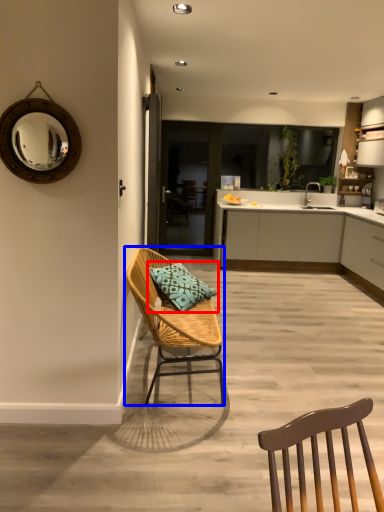
Question: Which object appears closest to the camera in this image, pillow (highlighted by a red box) or chair (highlighted by a blue box)?

Choices:
 (A) pillow
 (B) chair

Answer: (B)